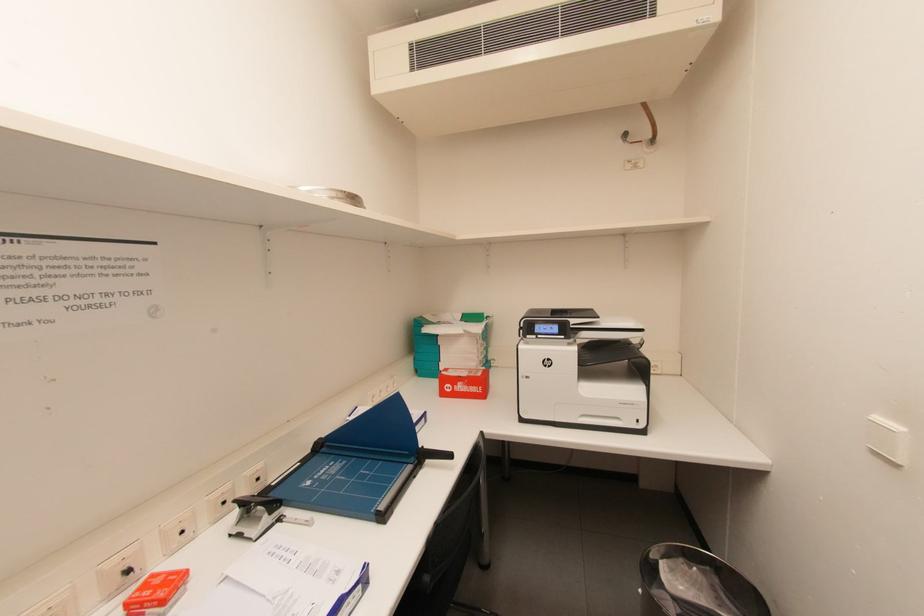
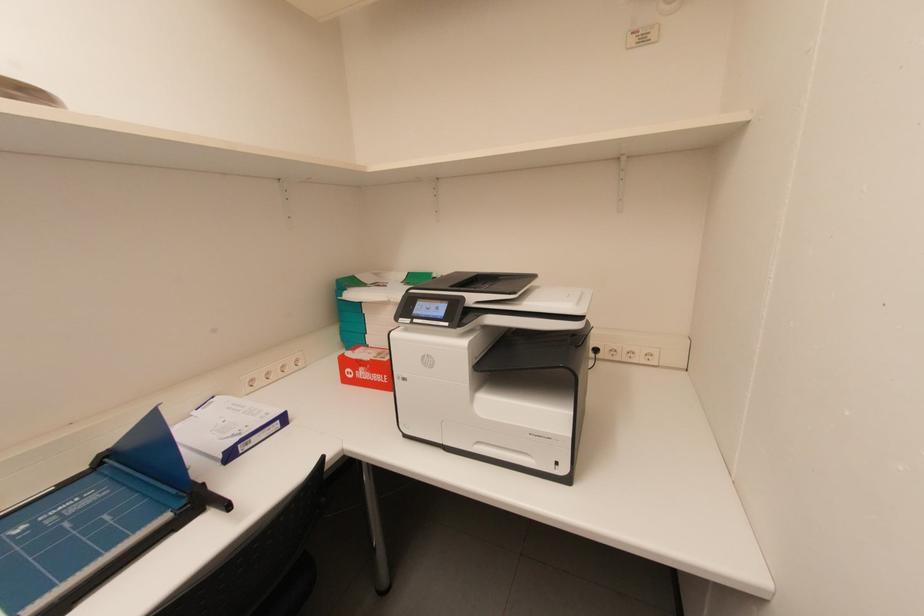
Question: The images are taken continuously from a first-person perspective. In which direction is your viewpoint rotating?

Choices:
 (A) Left
 (B) Right
 (C) Up
 (D) Down

Answer: (D)